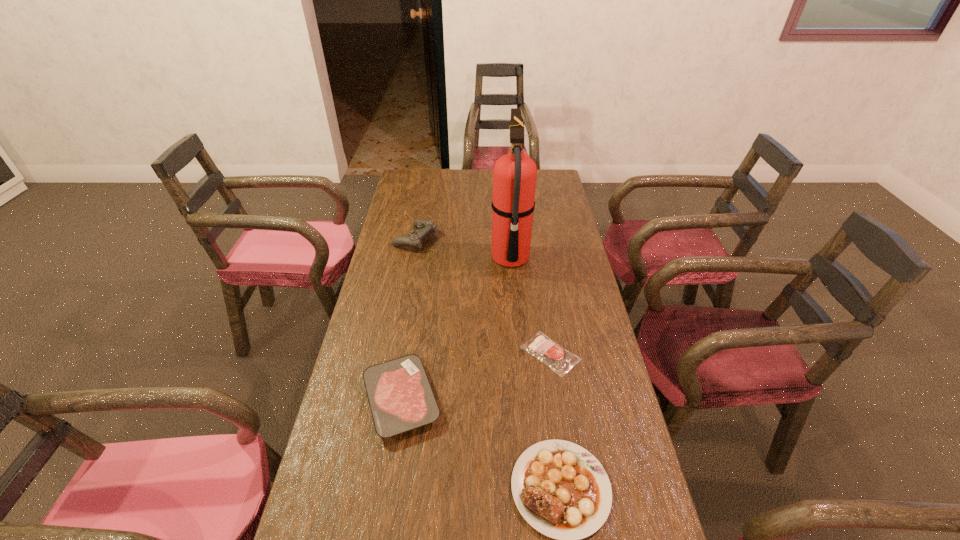
Find the location of a particular element. This screenshot has width=960, height=540. the tallest object is located at coordinates (514, 175).

You are a GUI agent. You are given a task and a screenshot of the screen. Output one action in this format:
    pyautogui.click(x=<x>, y=<y>)
    Task: Click on the control
    This screenshot has height=540, width=960.
    Given the screenshot: What is the action you would take?
    tap(425, 227)

Identify the location of the second shortest steak. The width and height of the screenshot is (960, 540). (400, 396).

I want to click on the leftmost steak, so click(400, 396).

Where is `the shortest steak`? the shortest steak is located at coordinates (557, 358).

Identify the location of free space located at the nozzle of the tallest object. The width and height of the screenshot is (960, 540). (452, 258).

I want to click on vacant region located at the nozzle of the tallest object, so click(x=403, y=258).

Where is `vacant region located 0.200m at the nozzle of the tallest object`? vacant region located 0.200m at the nozzle of the tallest object is located at coordinates (436, 258).

Find the location of `vacant space located on the back of the control`. vacant space located on the back of the control is located at coordinates (425, 187).

Identify the location of vacant position located 0.320m on the back of the fourth tallest object. (419, 286).